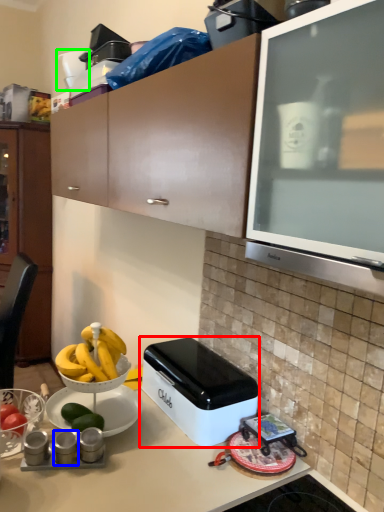
Question: Which object is the closest to the home appliance (highlighted by a red box)? Choose among these: appliance (highlighted by a blue box) or appliance (highlighted by a green box).

Choices:
 (A) appliance
 (B) appliance

Answer: (A)